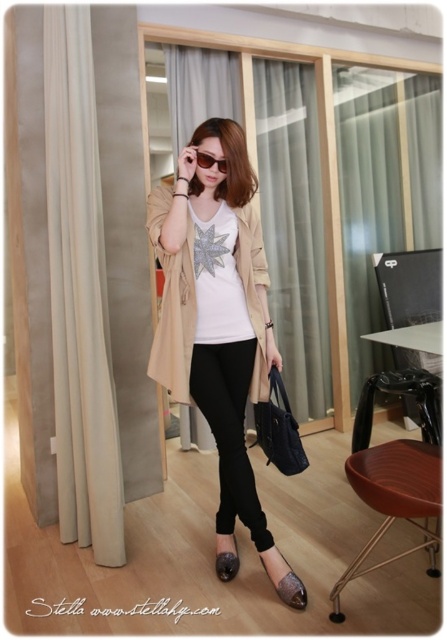
Which is more to the right, beige fabric coat at center or leather-like metallic sandal at lower center?

leather-like metallic sandal at lower center

Does beige fabric coat at center appear on the right side of leather-like metallic sandal at lower center?

Incorrect, beige fabric coat at center is not on the right side of leather-like metallic sandal at lower center.

Does point (240, 236) lie behind point (295, 579)?

That is True.

This screenshot has width=447, height=640. Identify the location of beige fabric coat at center. (172, 301).

Is beige fabric coat at center to the left of sunglasses at center from the viewer's perspective?

No, beige fabric coat at center is not to the left of sunglasses at center.

Between beige fabric coat at center and sunglasses at center, which one is positioned lower?

beige fabric coat at center is below.

Between point (185, 401) and point (203, 163), which one is positioned in front?

Point (203, 163) is in front.

The width and height of the screenshot is (447, 640). In order to click on beige fabric coat at center in this screenshot , I will do `click(172, 301)`.

Who is more distant from viewer, (163, 320) or (282, 579)?

The point (163, 320) is more distant.

Who is more forward, (164, 205) or (278, 582)?

Point (164, 205) is more forward.

The image size is (447, 640). I want to click on matte beige cardigan at center, so click(216, 314).